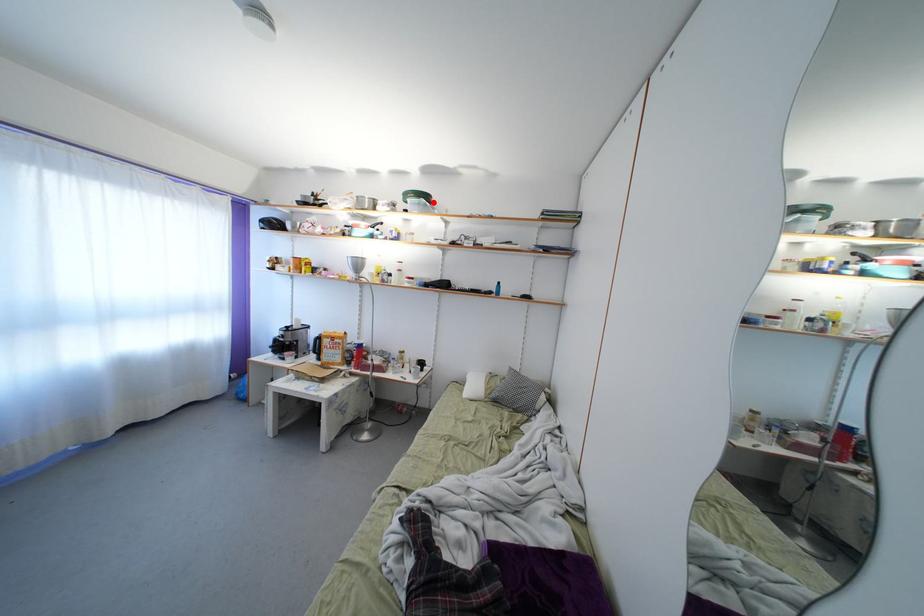
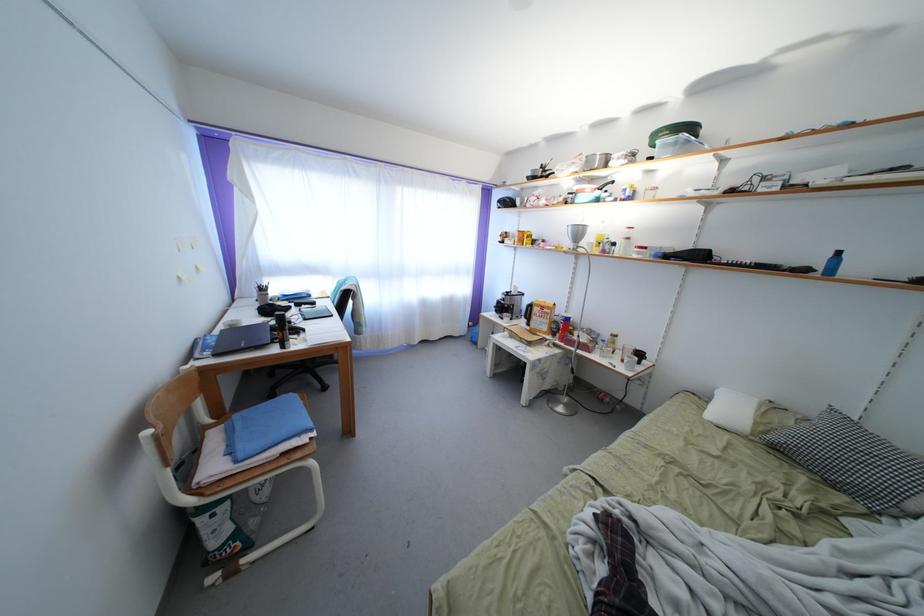
Find the pixel in the second image that matches the highlighted location in the first image.

(698, 134)